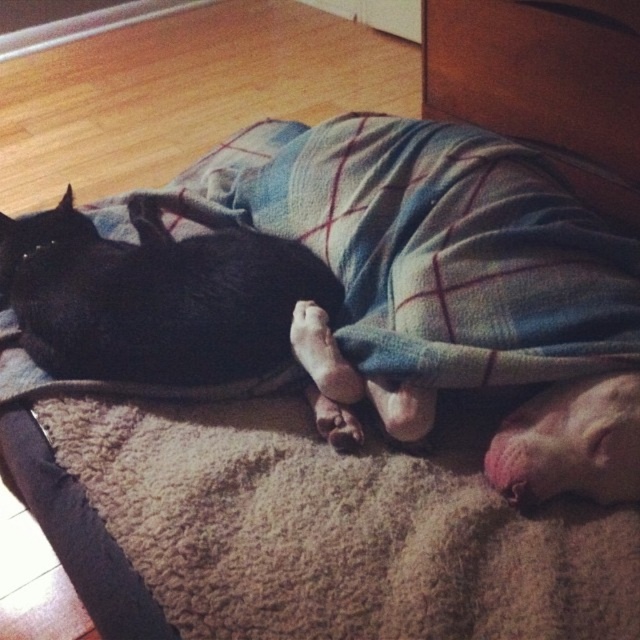
You are a robot trying to locate the plaid fabric blanket at center in the image. What are the coordinates where you should look?

The plaid fabric blanket at center is located at coordinates point (436, 246).

You are a drone operator trying to capture a photo of the two points in the scene. The first point is at coordinate point (627, 285) and the second is at point (122, 337). From the perspective of the camera, which point is closer to the front of the image?

Point (627, 285) is in front of point (122, 337), so it is closer to the front of the image.

You are a person who wants to place a small toy between the black fur cat at left and the wooden drawer at upper center. Based on their sizes, can the toy be placed in between them without needing to move either object?

The black fur cat at left is shorter than the wooden drawer at upper center, so the toy can be placed between them as there is vertical space available between the two objects.